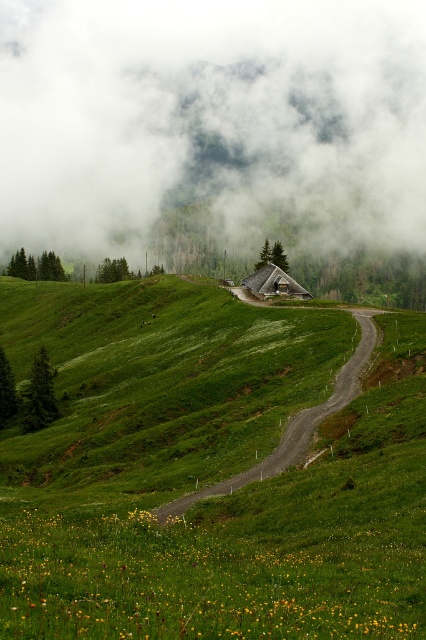
You are standing at the point closest to the camera in the image. Which point, point (215, 67) or point (157, 509), is farther away from you?

Point (215, 67) is farther away because it is behind point (157, 509), which is closer to the camera.

You are a hiker trying to reach the rustic building on the hill. You see the green grassy hillside at center and the gravel road at center. Which path should you take to stay on the road leading towards the building?

The gravel road at center is the correct path to take towards the rustic building. The green grassy hillside at center is located to the left of the road, so staying on the gravel road at center will lead you in the right direction.

You are standing at the origin point of this rural landscape. Based on the coordinates provided, where exactly is the green grassy hillside at center located?

The green grassy hillside at center is located at coordinates point (207, 472).